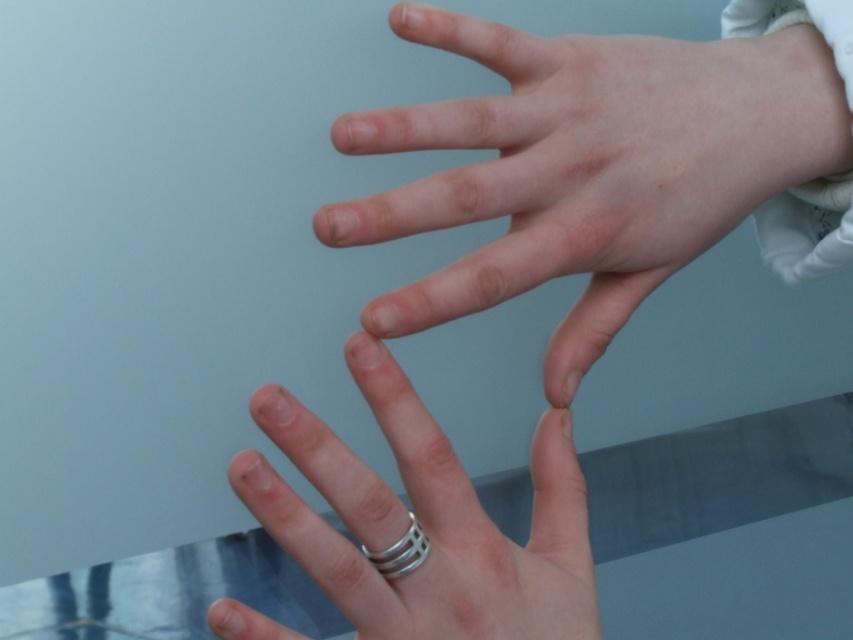
You are a photographer adjusting the focus on a camera. You notice two hands in the frame, one closer to the camera and slightly blurred, the other further back and more in focus. There is a point at coordinates [589,166] in the image. Based on the scene description, which hand does this point belong to?

The point at coordinates [589,166] corresponds to the pale skin hand at center, which is the hand further back and more in focus.

You are a photographer trying to capture a clear image of the transparent glass table at lower center. However, there is a pale skin hand at center blocking your view. Can you move the hand to the side to get an unobstructed shot of the table?

The pale skin hand at center is in front of the transparent glass table at lower center, so moving the hand to the side would allow you to see the table without obstruction.